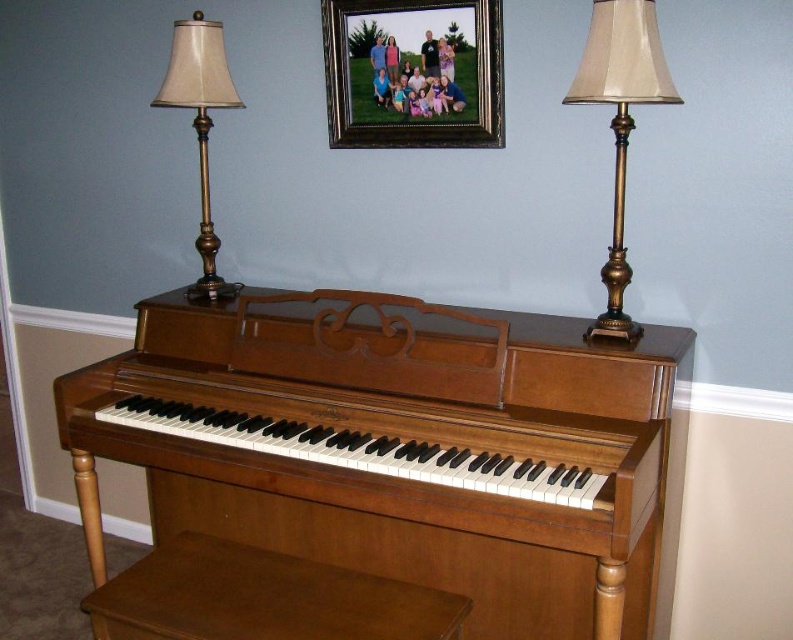
Question: Observing the image, what is the correct spatial positioning of wooden piano at center in reference to wooden picture frame at upper center?

Choices:
 (A) above
 (B) below

Answer: (B)

Question: Which is farther from the wooden piano at center?

Choices:
 (A) wooden picture frame at upper center
 (B) wooden stool at lower center
 (C) gold metallic lampshade at left

Answer: (A)

Question: Can you confirm if gold metallic table lamp at right is thinner than gold metallic lampshade at left?

Choices:
 (A) no
 (B) yes

Answer: (B)

Question: Which point is farther to the camera?

Choices:
 (A) gold metallic table lamp at right
 (B) wooden piano at center
 (C) wooden stool at lower center

Answer: (A)

Question: Does wooden picture frame at upper center have a greater width compared to gold metallic table lamp at right?

Choices:
 (A) yes
 (B) no

Answer: (A)

Question: Considering the real-world distances, which object is farthest from the gold metallic lampshade at left?

Choices:
 (A) wooden picture frame at upper center
 (B) wooden piano at center
 (C) gold metallic table lamp at right
 (D) wooden stool at lower center

Answer: (C)